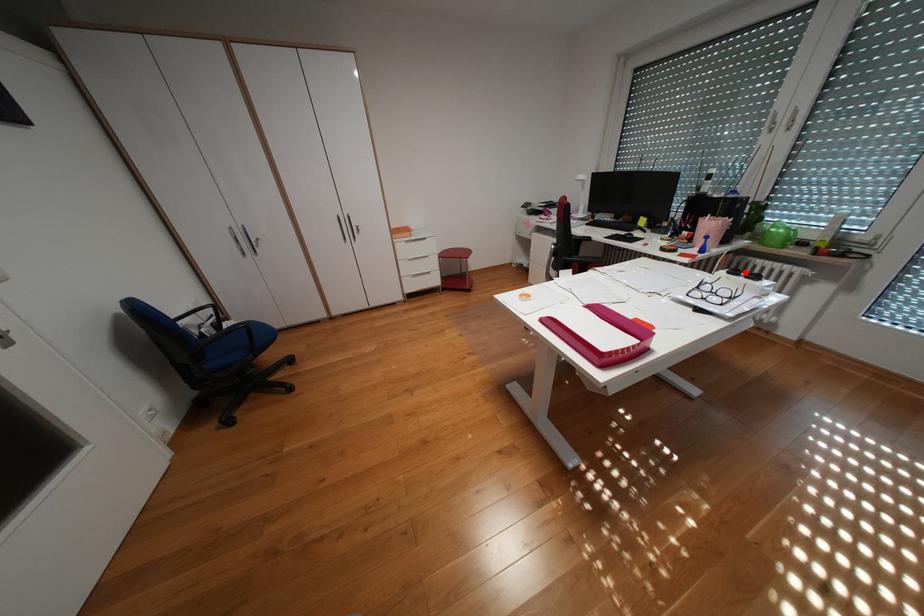
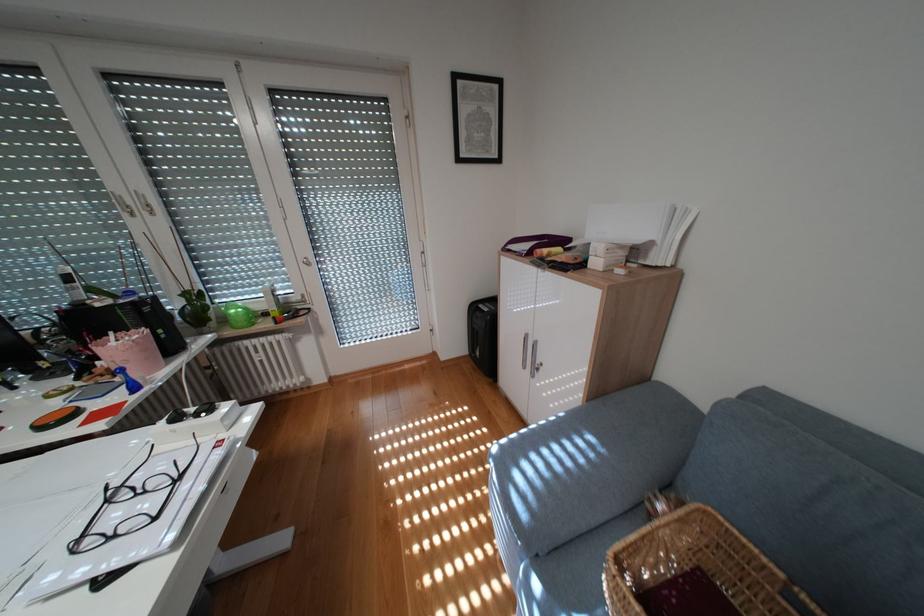
Find the pixel in the second image that matches the highlighted location in the first image.

(188, 418)